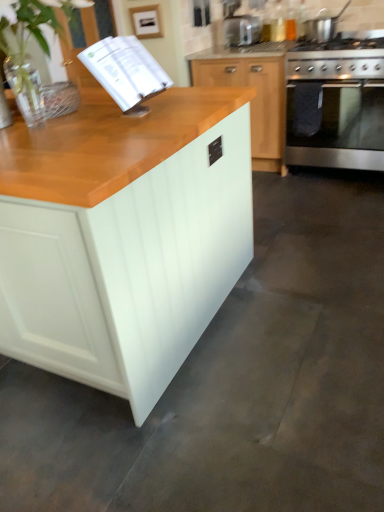
Question: Is satin silver toaster at upper center taller or shorter than stainless steel oven at right?

Choices:
 (A) tall
 (B) short

Answer: (B)

Question: Visually, is satin silver toaster at upper center positioned to the left or to the right of stainless steel oven at right?

Choices:
 (A) right
 (B) left

Answer: (B)

Question: Which object is positioned farthest from the stainless steel oven at right?

Choices:
 (A) satin silver toaster at upper center
 (B) stainless steel gas stove at upper right
 (C) white matte cabinet at center, the 1th cabinetry from the front
 (D) light wood cabinetry at center, which is the 2th cabinetry in front-to-back order
 (E) white paper book at upper left

Answer: (C)

Question: Estimate the real-world distances between objects in this image. Which object is farther from the green leafy plant at upper left?

Choices:
 (A) satin silver toaster at upper center
 (B) light wood cabinetry at center, placed as the first cabinetry when sorted from right to left
 (C) white paper book at upper left
 (D) stainless steel pot at upper right
 (E) stainless steel gas stove at upper right

Answer: (D)